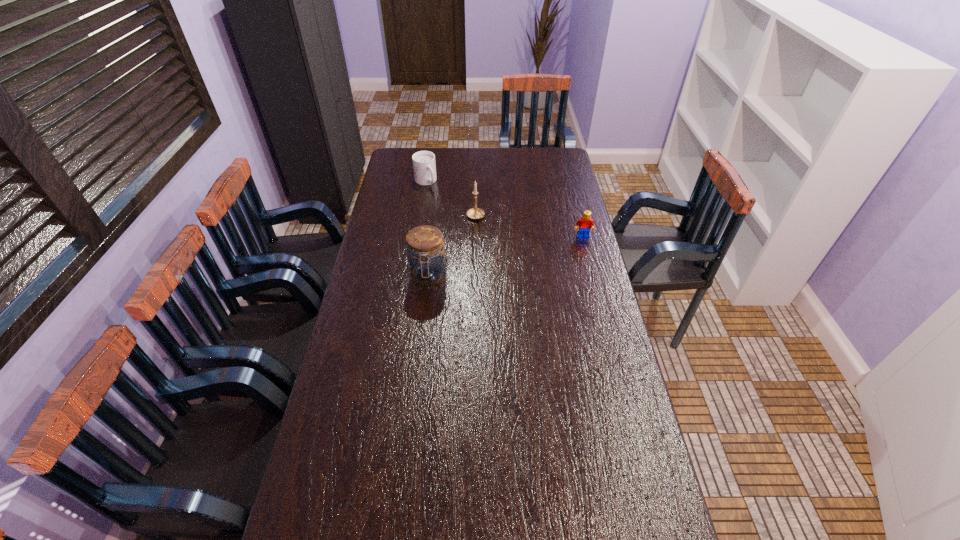
Locate an element on the screen. This screenshot has width=960, height=540. vacant space at the far right corner of the desktop is located at coordinates (561, 147).

Find the location of `vacant point located between the jar and the third nearest object`. vacant point located between the jar and the third nearest object is located at coordinates (452, 246).

Image resolution: width=960 pixels, height=540 pixels. What are the coordinates of `unoccupied position between the second farthest object and the nearest object` in the screenshot? It's located at (452, 246).

What are the coordinates of `vacant point located between the candle holder and the rightmost object` in the screenshot? It's located at (529, 227).

Locate an element on the screen. vacant area between the jar and the second nearest object is located at coordinates (506, 256).

Image resolution: width=960 pixels, height=540 pixels. What are the coordinates of `free space between the farthest object and the Lego` in the screenshot? It's located at (504, 209).

The width and height of the screenshot is (960, 540). In order to click on vacant space in between the second nearest object and the third nearest object in this screenshot , I will do `click(529, 227)`.

Locate an element on the screen. The width and height of the screenshot is (960, 540). vacant space that is in between the farthest object and the third nearest object is located at coordinates (450, 199).

The image size is (960, 540). Find the location of `object that is the third closest to the rightmost object`. object that is the third closest to the rightmost object is located at coordinates (424, 166).

Identify the location of object that stands as the closest to the second object from right to left. This screenshot has height=540, width=960. (424, 166).